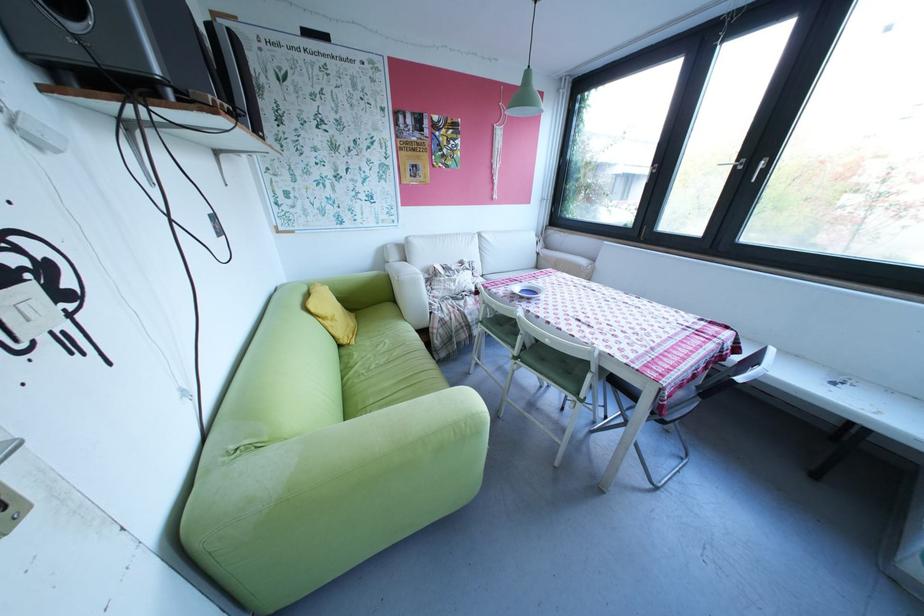
The location [444,140] corresponds to which object?

It corresponds to the small framed picture in the image.